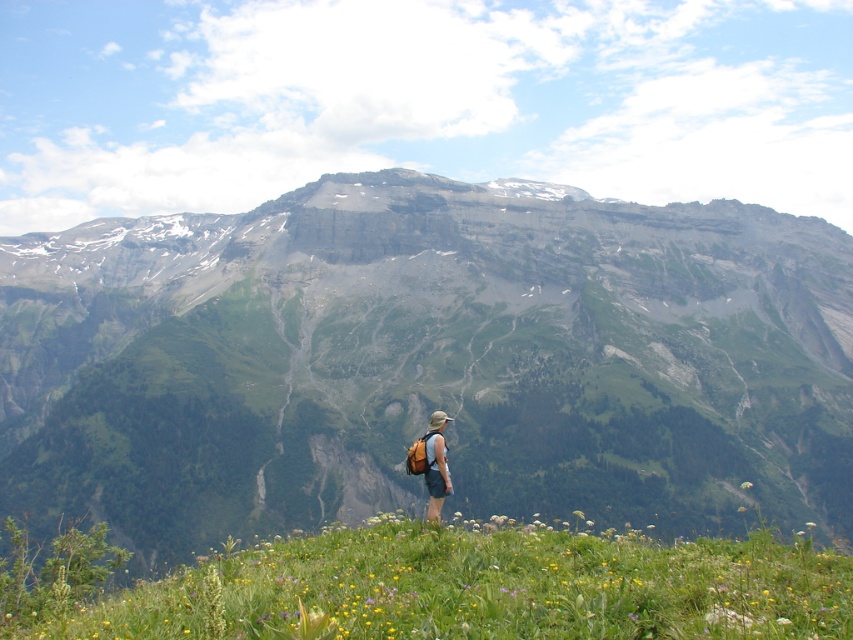
Can you confirm if green grassy hillside at lower center is positioned below green grassy at lower center?

Actually, green grassy hillside at lower center is above green grassy at lower center.

Is green grassy hillside at lower center positioned in front of green grassy at lower center?

No, it is behind green grassy at lower center.

At what (x,y) coordinates should I click in order to perform the action: click on green grassy hillside at lower center. Please return your answer as a coordinate pair (x, y). The image size is (853, 640). Looking at the image, I should click on (424, 360).

Does green grassy hillside at lower center appear over green matte flower at lower right?

Yes, green grassy hillside at lower center is above green matte flower at lower right.

This screenshot has width=853, height=640. Describe the element at coordinates (424, 360) in the screenshot. I see `green grassy hillside at lower center` at that location.

This screenshot has height=640, width=853. In order to click on green grassy hillside at lower center in this screenshot , I will do `click(424, 360)`.

Find the location of a particular element. green grassy hillside at lower center is located at coordinates (424, 360).

Who is shorter, green grassy hillside at lower center or matte khaki shorts at center?

Standing shorter between the two is matte khaki shorts at center.

Between green grassy hillside at lower center and matte khaki shorts at center, which one is positioned lower?

Positioned lower is matte khaki shorts at center.

Between point (453, 380) and point (439, 483), which one is positioned in front?

Point (439, 483)

You are a GUI agent. You are given a task and a screenshot of the screen. Output one action in this format:
    pyautogui.click(x=<x>, y=<y>)
    Task: Click on the green grassy hillside at lower center
    This screenshot has width=853, height=640.
    Given the screenshot: What is the action you would take?
    pyautogui.click(x=424, y=360)